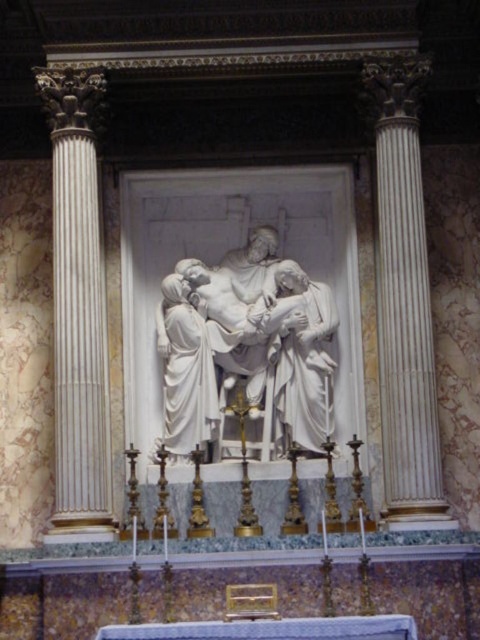
You are an art conservator examining the classical sculpture framed by two tall columns. You notice two points marked on the relief sculpture at coordinates point (419,454) and point (292,394). Which of these points is positioned closer to your viewpoint as you face the sculpture?

Point (419,454) is closer to the viewer than point (292,394).

You are standing in the classical sculpture area and need to locate two specific points marked on the floor. The first point is at coordinate point [403,184], and the second is at coordinate point [60,148]. Which point is closer to you when you first enter the room?

Point [403,184] is in front of point [60,148], so when you first enter the room, point [403,184] is closer to you.

You are standing in the cathedral and see two points marked on the floor. The first point is at coordinates point [216,333] and the second is at point [420,461]. Which point is closer to the entrance of the cathedral?

Point [420,461] is closer to the entrance of the cathedral because it is in front of point [216,333].